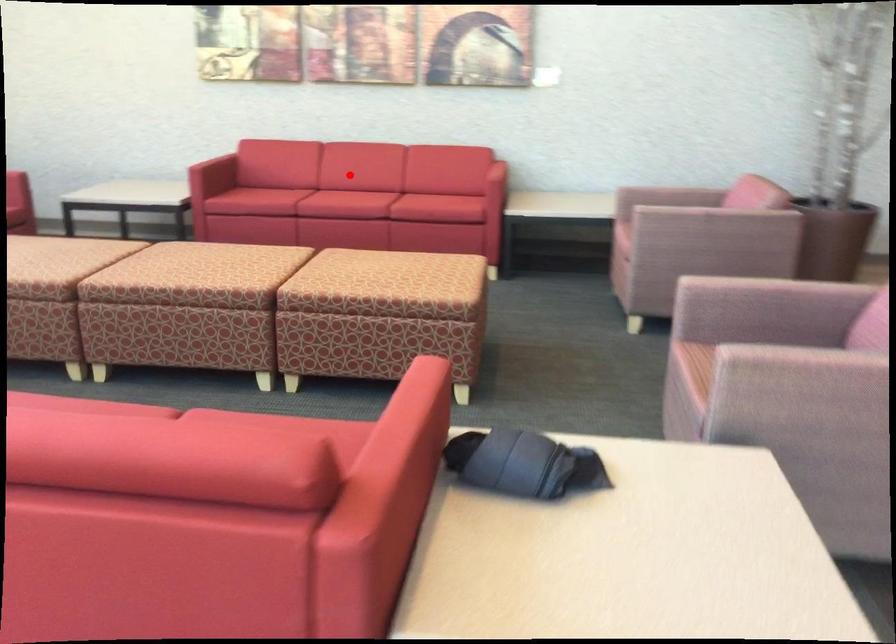
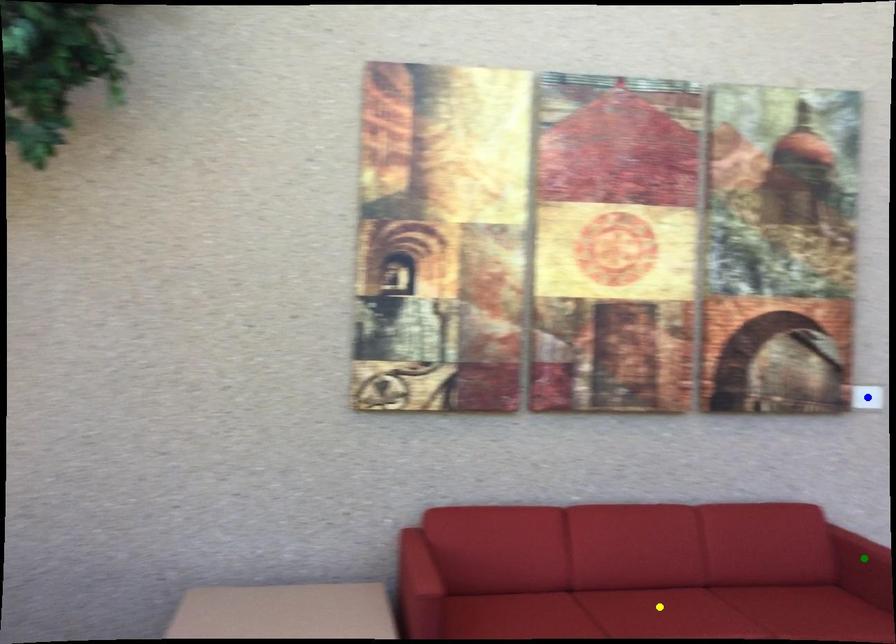
Question: I am providing you with two images of the same scene from different viewpoints. A red point is marked on the first image. You are given multiple points on the second image. Which point in image 2 is actually the same real-world point as the red point in image 1?

Choices:
 (A) yellow point
 (B) blue point
 (C) green point

Answer: (A)